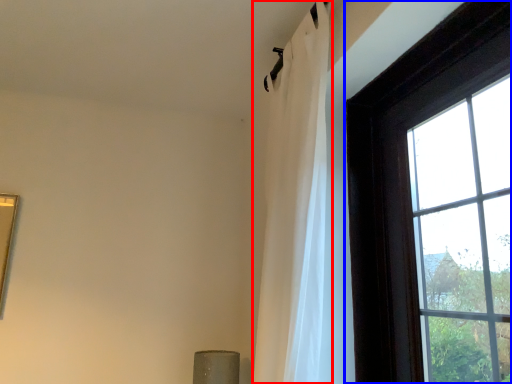
Question: Which object appears closest to the camera in this image, curtain (highlighted by a red box) or window (highlighted by a blue box)?

Choices:
 (A) curtain
 (B) window

Answer: (B)